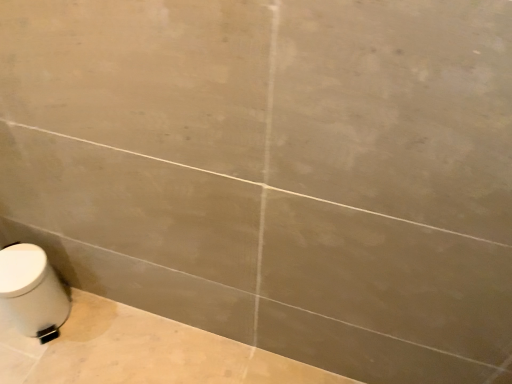
Question: Can you confirm if white glossy toilet at lower left is bigger than white glossy toilet at lower left?

Choices:
 (A) no
 (B) yes

Answer: (B)

Question: Is white glossy toilet at lower left facing away from white glossy toilet at lower left?

Choices:
 (A) no
 (B) yes

Answer: (B)

Question: Is white glossy toilet at lower left next to white glossy toilet at lower left and touching it?

Choices:
 (A) yes
 (B) no

Answer: (B)

Question: From a real-world perspective, is white glossy toilet at lower left over white glossy toilet at lower left?

Choices:
 (A) yes
 (B) no

Answer: (A)

Question: From a real-world perspective, is white glossy toilet at lower left positioned under white glossy toilet at lower left based on gravity?

Choices:
 (A) yes
 (B) no

Answer: (B)

Question: Is there a large distance between white glossy toilet at lower left and white glossy toilet at lower left?

Choices:
 (A) no
 (B) yes

Answer: (A)

Question: Considering the relative sizes of white glossy toilet at lower left and white glossy toilet at lower left in the image provided, is white glossy toilet at lower left wider than white glossy toilet at lower left?

Choices:
 (A) no
 (B) yes

Answer: (B)

Question: From a real-world perspective, is white glossy toilet at lower left located beneath white glossy toilet at lower left?

Choices:
 (A) no
 (B) yes

Answer: (B)

Question: Considering the relative sizes of white glossy toilet at lower left and white glossy toilet at lower left in the image provided, is white glossy toilet at lower left shorter than white glossy toilet at lower left?

Choices:
 (A) no
 (B) yes

Answer: (B)

Question: Can you confirm if white glossy toilet at lower left is smaller than white glossy toilet at lower left?

Choices:
 (A) yes
 (B) no

Answer: (A)

Question: Can you confirm if white glossy toilet at lower left is positioned to the left of white glossy toilet at lower left?

Choices:
 (A) no
 (B) yes

Answer: (B)

Question: From the image's perspective, is white glossy toilet at lower left over white glossy toilet at lower left?

Choices:
 (A) no
 (B) yes

Answer: (A)

Question: Is white glossy toilet at lower left situated inside white glossy toilet at lower left or outside?

Choices:
 (A) inside
 (B) outside

Answer: (B)